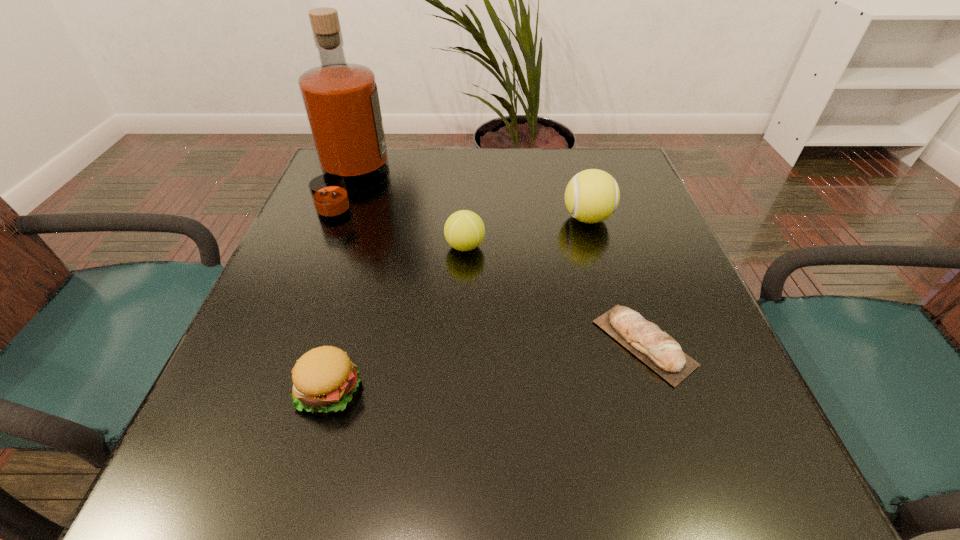
At what (x,y) coordinates should I click in order to perform the action: click on free space between the tallest object and the second shortest object. Please return your answer as a coordinate pair (x, y). This screenshot has width=960, height=540. Looking at the image, I should click on (341, 288).

Locate an element on the screen. free space between the pita bread and the right tennis ball is located at coordinates (615, 281).

Locate an element on the screen. free space that is in between the tallest object and the second shortest object is located at coordinates click(341, 288).

This screenshot has height=540, width=960. Identify the location of empty space that is in between the tallest object and the third shortest object. (409, 217).

The image size is (960, 540). In order to click on vacant point located between the tallest object and the taller tennis ball in this screenshot , I will do `click(469, 202)`.

Identify the location of object that is the second nearest to the pita bread. The width and height of the screenshot is (960, 540). (464, 230).

Choose which object is the fourth nearest neighbor to the third object from left to right. Please provide its 2D coordinates. Your answer should be formatted as a tuple, i.e. [(x, y)], where the tuple contains the x and y coordinates of a point satisfying the conditions above.

[(324, 378)]

Where is `free spot that satisfies the following two spatial constraints: 1. on the front label of the liquor; 2. on the back side of the shorter tennis ball`? This screenshot has height=540, width=960. free spot that satisfies the following two spatial constraints: 1. on the front label of the liquor; 2. on the back side of the shorter tennis ball is located at coordinates tap(329, 246).

The image size is (960, 540). Identify the location of vacant area that satisfies the following two spatial constraints: 1. on the front label of the fourth tallest object; 2. on the left side of the liquor. (275, 390).

Find the location of `vacant space that satisfies the following two spatial constraints: 1. on the front side of the shortest object; 2. on the left side of the fourth shortest object`. vacant space that satisfies the following two spatial constraints: 1. on the front side of the shortest object; 2. on the left side of the fourth shortest object is located at coordinates (624, 343).